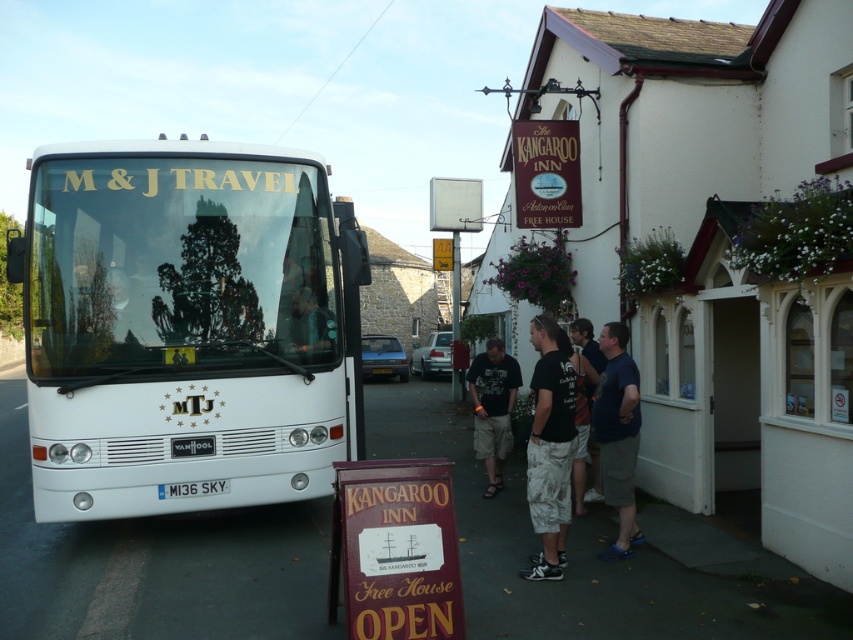
Question: Is dark gray t-shirt at center positioned in front of camouflage shorts at center?

Choices:
 (A) no
 (B) yes

Answer: (A)

Question: Which of these objects is positioned closest to the dark gray t-shirt at center?

Choices:
 (A) wooden signboard at center
 (B) white matte bus at left

Answer: (B)

Question: Considering the relative positions of wooden signboard at center and dark blue t-shirt at center in the image provided, where is wooden signboard at center located with respect to dark blue t-shirt at center?

Choices:
 (A) left
 (B) right

Answer: (A)

Question: Does black cotton t-shirt at center appear over camouflage shorts at center?

Choices:
 (A) yes
 (B) no

Answer: (A)

Question: Estimate the real-world distances between objects in this image. Which object is farther from the camouflage shorts at center?

Choices:
 (A) black cotton t-shirt at center
 (B) dark blue t-shirt at center
 (C) dark gray t-shirt at center

Answer: (A)

Question: Which point appears closest to the camera in this image?

Choices:
 (A) (532, 509)
 (B) (616, 333)

Answer: (A)